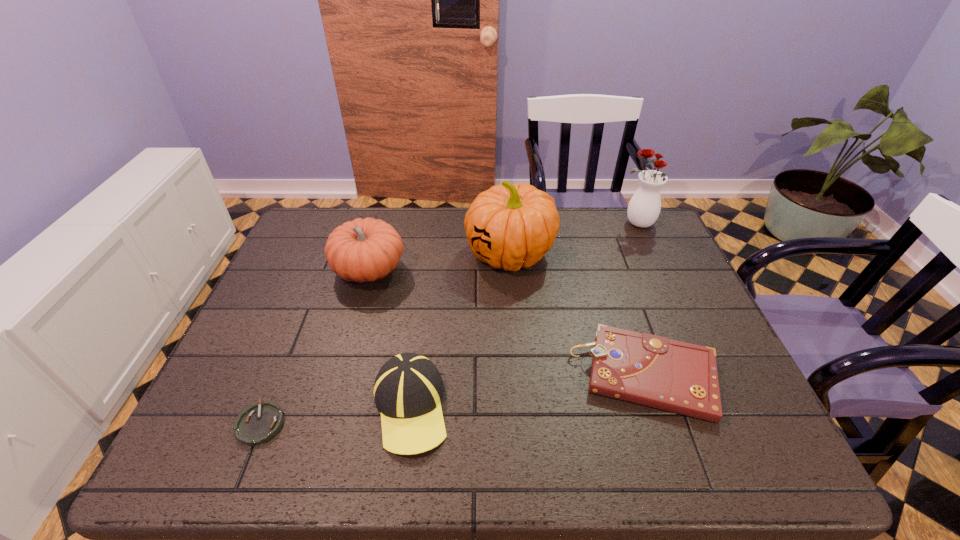
Locate an element on the screen. This screenshot has width=960, height=540. vase is located at coordinates (644, 207).

Locate an element on the screen. Image resolution: width=960 pixels, height=540 pixels. the taller pumpkin is located at coordinates (511, 226).

Image resolution: width=960 pixels, height=540 pixels. Identify the location of the left pumpkin. (363, 250).

Image resolution: width=960 pixels, height=540 pixels. I want to click on the shorter pumpkin, so click(363, 250).

I want to click on the third shortest object, so click(x=408, y=389).

The image size is (960, 540). In order to click on notebook in this screenshot , I will do `click(646, 369)`.

This screenshot has width=960, height=540. In order to click on ashtray in this screenshot , I will do `click(257, 424)`.

At what (x,y) coordinates should I click in order to perform the action: click on free space located 0.300m on the left of the vase. Please return your answer as a coordinate pair (x, y). The image size is (960, 540). Looking at the image, I should click on (529, 224).

Find the location of a particular element. vacant space situated on the surface of the right pumpkin is located at coordinates (405, 254).

This screenshot has height=540, width=960. Find the location of `vacant position located on the surface of the right pumpkin`. vacant position located on the surface of the right pumpkin is located at coordinates (356, 254).